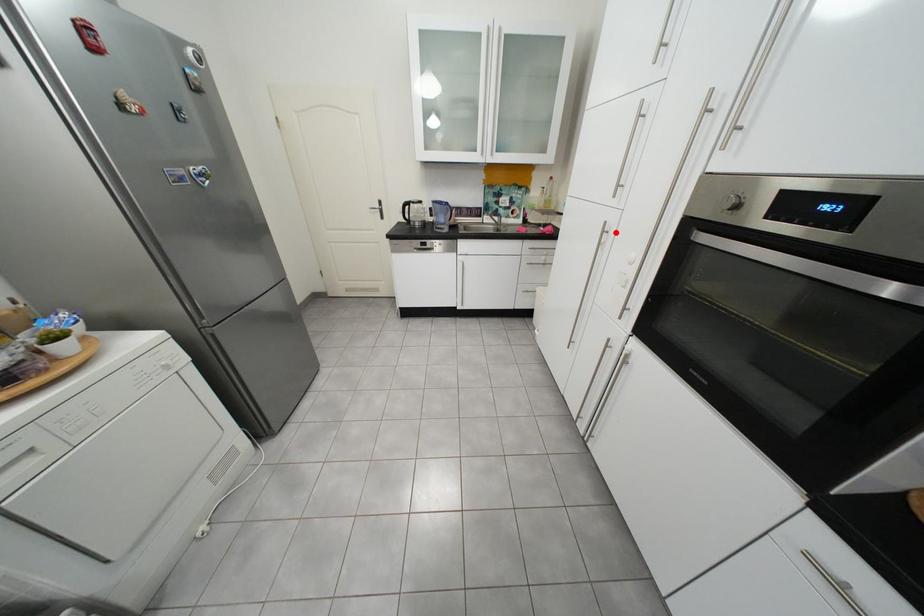
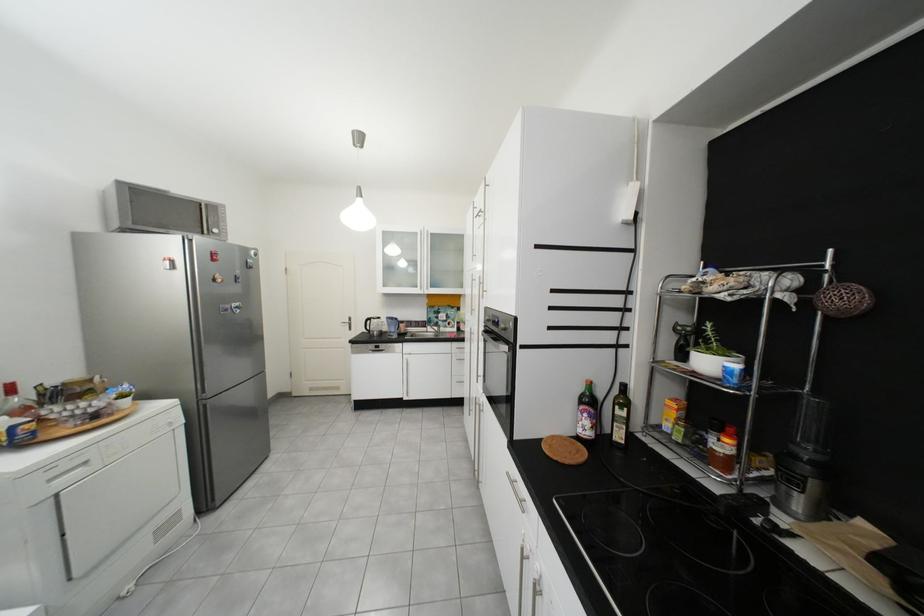
Question: A red point is marked in image1. In image2, is the corresponding 3D point closer to the camera or farther? Reply with the corresponding letter.

Choices:
 (A) The corresponding 3D point is closer.
 (B) The corresponding 3D point is farther.

Answer: (B)